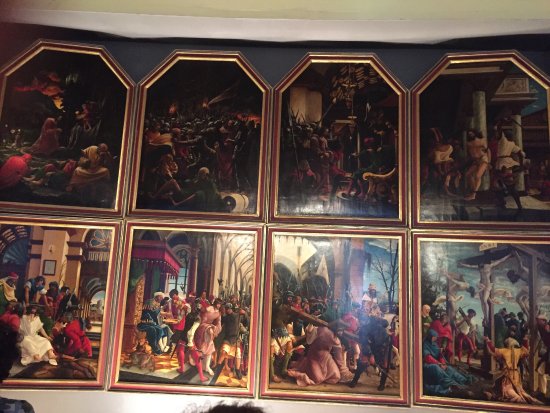
I want to click on picture, so click(223, 377).